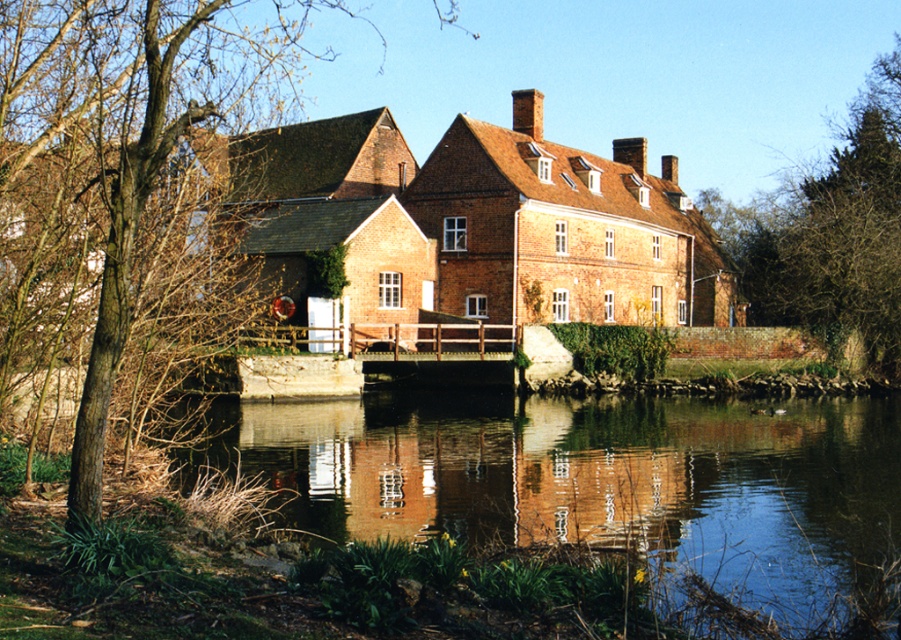
Question: Which point is farther to the camera?

Choices:
 (A) pyautogui.click(x=70, y=236)
 (B) pyautogui.click(x=785, y=321)

Answer: (B)

Question: Is brown leafless tree at left below green leafy tree at upper right?

Choices:
 (A) yes
 (B) no

Answer: (B)

Question: Which object is the farthest from the brown leafless tree at left?

Choices:
 (A) green leafy tree at upper right
 (B) smooth reflective water at center

Answer: (A)

Question: Which object appears closest to the camera in this image?

Choices:
 (A) green leafy tree at upper right
 (B) brown leafless tree at left
 (C) smooth reflective water at center

Answer: (C)

Question: Does smooth reflective water at center have a larger size compared to brown leafless tree at left?

Choices:
 (A) no
 (B) yes

Answer: (A)

Question: Does smooth reflective water at center come in front of brown leafless tree at left?

Choices:
 (A) yes
 (B) no

Answer: (A)